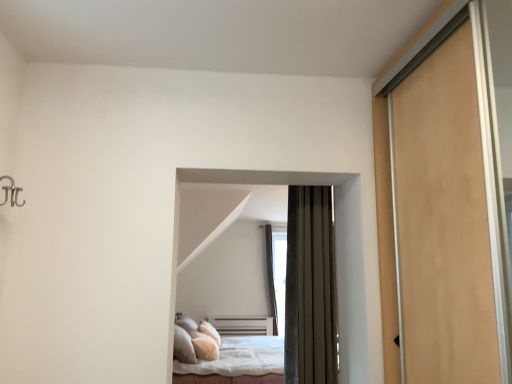
Question: Is dark brown fabric bed at center, the 1th bed viewed from the top, to the right of transparent glass window at center from the viewer's perspective?

Choices:
 (A) yes
 (B) no

Answer: (B)

Question: Would you say dark brown fabric bed at center, which ranks as the 2th bed in back-to-front order, is outside transparent glass window at center?

Choices:
 (A) yes
 (B) no

Answer: (A)

Question: Can you confirm if dark brown fabric bed at center, which ranks as the first bed in front-to-back order, is thinner than transparent glass window at center?

Choices:
 (A) no
 (B) yes

Answer: (B)

Question: Can you confirm if dark brown fabric bed at center, which ranks as the 2th bed in back-to-front order, is bigger than transparent glass window at center?

Choices:
 (A) yes
 (B) no

Answer: (B)

Question: From the image's perspective, does dark brown fabric bed at center, the 1th bed viewed from the top, appear lower than transparent glass window at center?

Choices:
 (A) yes
 (B) no

Answer: (B)

Question: From a real-world perspective, relative to dark brown fabric bed at center, which is the 2th bed from bottom to top, is white soft bed at center, which appears as the second bed when viewed from the top, vertically above or below?

Choices:
 (A) below
 (B) above

Answer: (A)

Question: From the image's perspective, is white soft bed at center, which is the second bed in front-to-back order, above or below dark brown fabric bed at center, which ranks as the first bed in front-to-back order?

Choices:
 (A) below
 (B) above

Answer: (A)

Question: Which is correct: white soft bed at center, which appears as the second bed when viewed from the top, is inside dark brown fabric bed at center, which ranks as the 2th bed in back-to-front order, or outside of it?

Choices:
 (A) inside
 (B) outside

Answer: (B)

Question: Considering the positions of white soft bed at center, marked as the first bed in a bottom-to-top arrangement, and dark brown fabric bed at center, which is the 2th bed from bottom to top, in the image, is white soft bed at center, marked as the first bed in a bottom-to-top arrangement, wider or thinner than dark brown fabric bed at center, which is the 2th bed from bottom to top,?

Choices:
 (A) thin
 (B) wide

Answer: (B)

Question: Is dark brown fabric bed at center, which ranks as the first bed in front-to-back order, to the left or to the right of white soft bed at center, which is the second bed in front-to-back order, in the image?

Choices:
 (A) right
 (B) left

Answer: (A)

Question: Considering the positions of point (245, 178) and point (207, 360), is point (245, 178) closer or farther from the camera than point (207, 360)?

Choices:
 (A) closer
 (B) farther

Answer: (A)

Question: From the image's perspective, relative to white soft bed at center, which appears as the second bed when viewed from the top, is dark brown fabric bed at center, which is the 2th bed from bottom to top, above or below?

Choices:
 (A) below
 (B) above

Answer: (B)

Question: In terms of size, does dark brown fabric bed at center, the 1th bed viewed from the top, appear bigger or smaller than white soft bed at center, which is the second bed in front-to-back order?

Choices:
 (A) small
 (B) big

Answer: (A)

Question: From a real-world perspective, relative to transparent glass window at center, is dark brown fabric bed at center, the 1th bed viewed from the top, vertically above or below?

Choices:
 (A) below
 (B) above

Answer: (B)

Question: Is dark brown fabric bed at center, the 1th bed viewed from the top, to the left or to the right of transparent glass window at center in the image?

Choices:
 (A) left
 (B) right

Answer: (A)